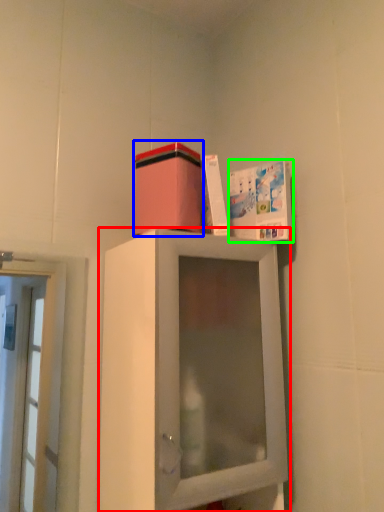
Question: Estimate the real-world distances between objects in this image. Which object is closer to cabinetry (highlighted by a red box), cardboard box (highlighted by a blue box) or book cover (highlighted by a green box)?

Choices:
 (A) cardboard box
 (B) book cover

Answer: (A)